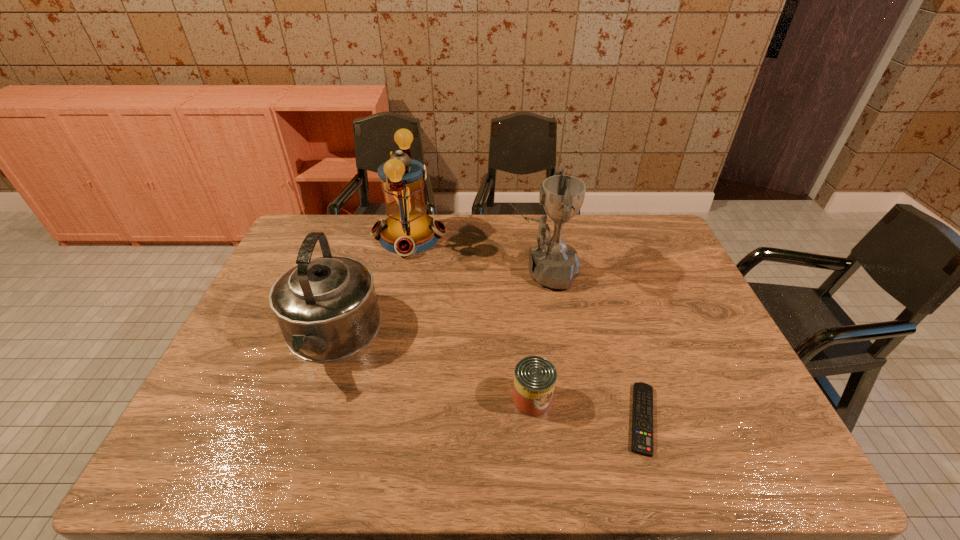
The height and width of the screenshot is (540, 960). What are the coordinates of `vacant space at the right edge of the desktop` in the screenshot? It's located at (661, 289).

Where is `vacant space at the far left corner of the desktop`? This screenshot has width=960, height=540. vacant space at the far left corner of the desktop is located at coordinates (345, 218).

The height and width of the screenshot is (540, 960). What are the coordinates of `free space that is in between the lantern and the shortest object` in the screenshot? It's located at (526, 327).

At what (x,y) coordinates should I click in order to perform the action: click on free space between the third tallest object and the fourth tallest object. Please return your answer as a coordinate pair (x, y). Looking at the image, I should click on (431, 368).

Identify the location of vacant space that is in between the shortest object and the award. (592, 345).

The height and width of the screenshot is (540, 960). What are the coordinates of `free space between the can and the kettle` in the screenshot? It's located at (431, 368).

This screenshot has height=540, width=960. Find the location of `free space between the can and the award`. free space between the can and the award is located at coordinates (538, 335).

This screenshot has height=540, width=960. What are the coordinates of `free space between the shortest object and the third tallest object` in the screenshot? It's located at (486, 377).

Find the location of a particular element. Image resolution: width=960 pixels, height=540 pixels. free point between the lantern and the award is located at coordinates (476, 254).

This screenshot has width=960, height=540. I want to click on free space between the can and the award, so click(x=538, y=335).